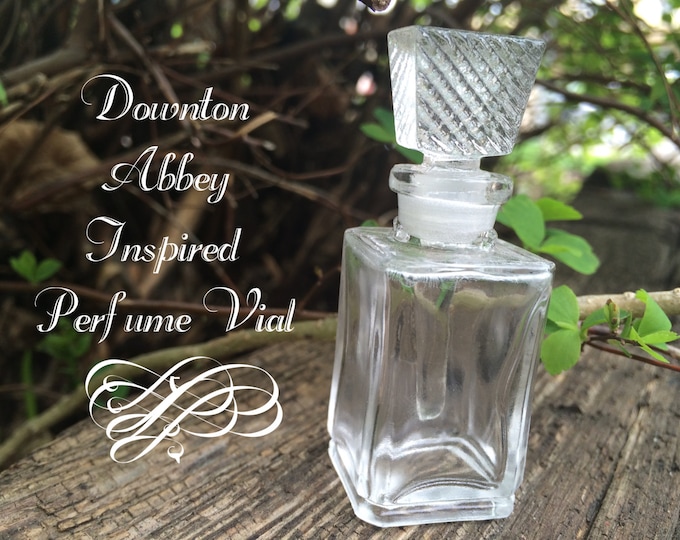
You are a GUI agent. You are given a task and a screenshot of the screen. Output one action in this format:
    pyautogui.click(x=<x>, y=<y>)
    Task: Click on the glass
    This screenshot has height=540, width=680.
    Given the screenshot: What is the action you would take?
    pyautogui.click(x=494, y=477)